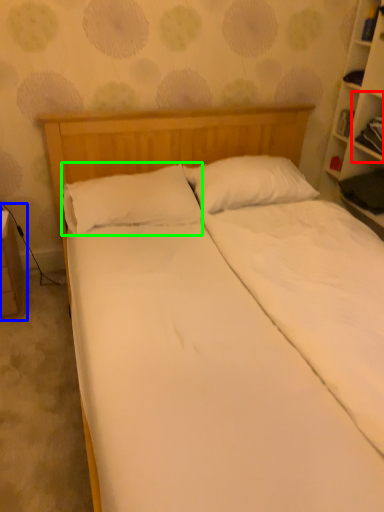
Question: Based on their relative distances, which object is farther from cabinet (highlighted by a red box)? Choose from table (highlighted by a blue box) and pillow (highlighted by a green box).

Choices:
 (A) table
 (B) pillow

Answer: (A)